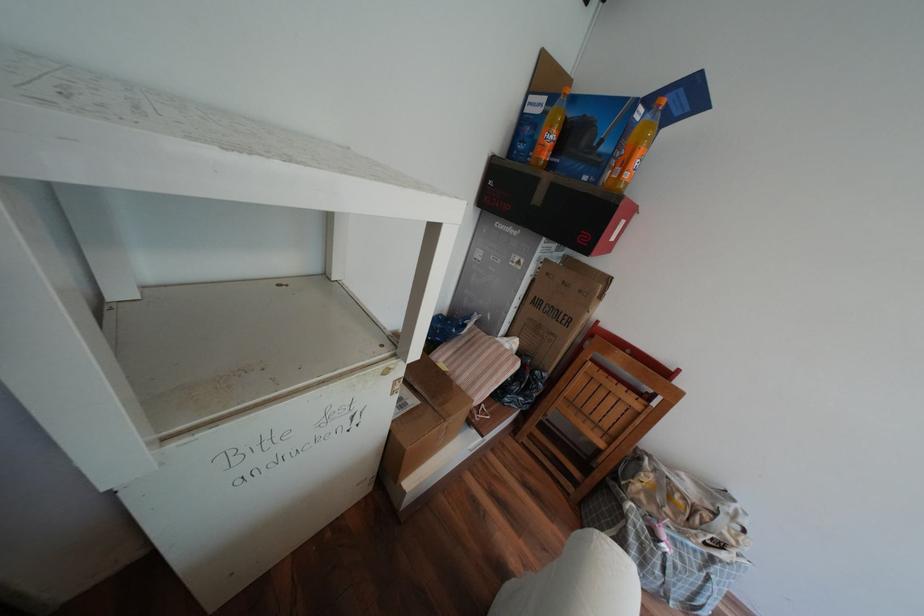
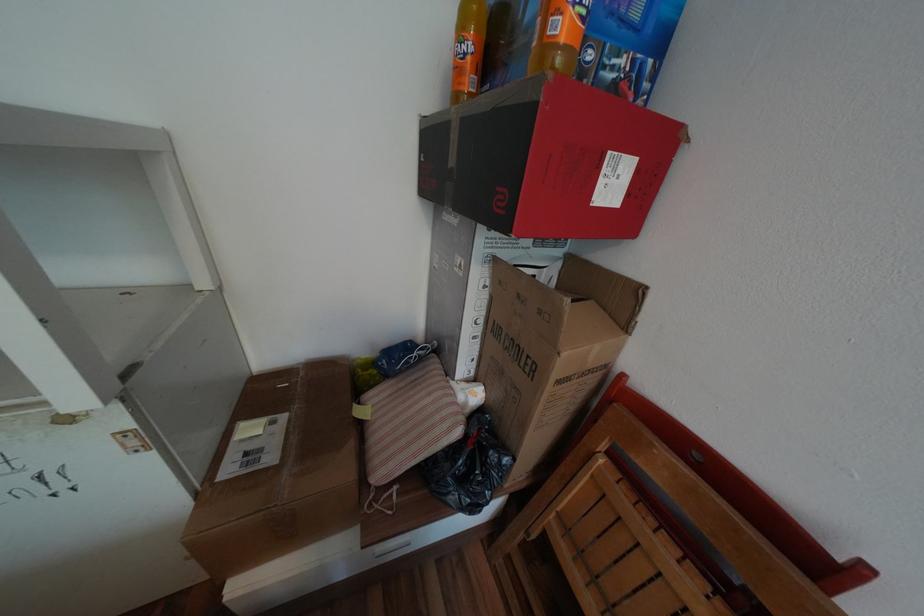
Locate, in the second image, the point that corresponds to [517,360] in the first image.

(453, 419)